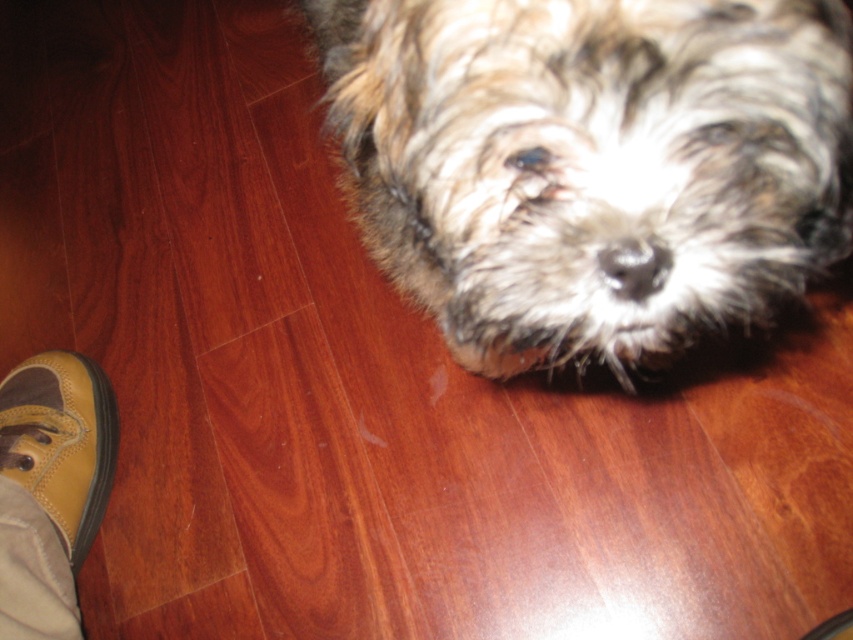
Is point (636, 186) closer to camera compared to point (3, 404)?

Yes, it is.

Which is behind, point (706, 8) or point (27, 444)?

Positioned behind is point (27, 444).

You are a GUI agent. You are given a task and a screenshot of the screen. Output one action in this format:
    pyautogui.click(x=<x>, y=<y>)
    Task: Click on the fuzzy brown dog at center
    
    Given the screenshot: What is the action you would take?
    pyautogui.click(x=592, y=163)